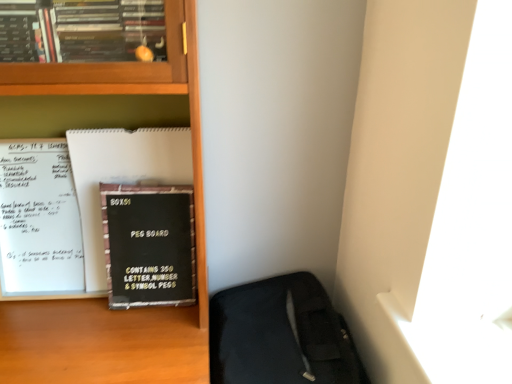
The height and width of the screenshot is (384, 512). I want to click on black matte peg board at center-left, so click(x=149, y=245).

Describe the element at coordinates (121, 176) in the screenshot. I see `black matte peg board at left` at that location.

What is the approximate height of black matte peg board at left?

black matte peg board at left is 17.56 inches in height.

Describe the element at coordinates (280, 335) in the screenshot. I see `black fabric sleeping bag at lower right` at that location.

Find the location of `black matte peg board at center-left`. black matte peg board at center-left is located at coordinates (149, 245).

Can we say black fabric sleeping bag at lower right lies outside wooden bookcase at center?

Absolutely, black fabric sleeping bag at lower right is external to wooden bookcase at center.

Is black fabric sleeping bag at lower right positioned far away from wooden bookcase at center?

black fabric sleeping bag at lower right is actually quite close to wooden bookcase at center.

Based on the photo, measure the distance from black fabric sleeping bag at lower right to wooden bookcase at center.

black fabric sleeping bag at lower right and wooden bookcase at center are 11.41 inches apart from each other.

From the picture: From the image's perspective, would you say black fabric sleeping bag at lower right is shown under wooden bookcase at center?

Yes, from the image's perspective, black fabric sleeping bag at lower right is below wooden bookcase at center.

Is black fabric sleeping bag at lower right surrounded by black matte peg board at left?

No, black matte peg board at left does not contain black fabric sleeping bag at lower right.

Locate an element on the screen. sleeping bag in front of the black matte peg board at left is located at coordinates (280, 335).

Does black matte peg board at left have a greater width compared to black fabric sleeping bag at lower right?

No, black matte peg board at left is not wider than black fabric sleeping bag at lower right.

Is black matte peg board at left turned away from black fabric sleeping bag at lower right?

That's not correct — black matte peg board at left is not looking away from black fabric sleeping bag at lower right.

From the image's perspective, is black matte peg board at left above or below black matte peg board at center-left?

Clearly, from the image's perspective, black matte peg board at left is above black matte peg board at center-left.

Can you see black matte peg board at left touching black matte peg board at center-left?

Yes, the surface of black matte peg board at left is in contact with black matte peg board at center-left.

Would you say black matte peg board at left is outside black matte peg board at center-left?

black matte peg board at left is positioned outside black matte peg board at center-left.

From a real-world perspective, is black matte peg board at left located beneath black matte peg board at center-left?

No.

Based on their positions, is wooden bookcase at center located to the left or right of black fabric sleeping bag at lower right?

wooden bookcase at center is to the left of black fabric sleeping bag at lower right.

Would you say wooden bookcase at center is a long distance from black fabric sleeping bag at lower right?

No, there isn't a large distance between wooden bookcase at center and black fabric sleeping bag at lower right.

Identify the location of sleeping bag below the wooden bookcase at center (from a real-world perspective). The image size is (512, 384). (280, 335).

Find the location of `book above the black fabric sleeping bag at lower right (from a real-world perspective)`. book above the black fabric sleeping bag at lower right (from a real-world perspective) is located at coordinates (149, 245).

From a real-world perspective, relative to black fabric sleeping bag at lower right, is black matte peg board at center-left vertically above or below?

Clearly, from a real-world perspective, black matte peg board at center-left is above black fabric sleeping bag at lower right.

Considering the sizes of black matte peg board at center-left and black fabric sleeping bag at lower right in the image, is black matte peg board at center-left bigger or smaller than black fabric sleeping bag at lower right?

black matte peg board at center-left is smaller than black fabric sleeping bag at lower right.

Visually, is black matte peg board at center-left positioned to the left or to the right of wooden bookcase at center?

Based on their positions, black matte peg board at center-left is located to the right of wooden bookcase at center.

Considering the sizes of objects black matte peg board at center-left and wooden bookcase at center in the image provided, who is shorter, black matte peg board at center-left or wooden bookcase at center?

With less height is black matte peg board at center-left.

Consider the image. Who is bigger, black matte peg board at center-left or wooden bookcase at center?

Bigger between the two is wooden bookcase at center.

Considering the positions of objects black matte peg board at center-left and black matte peg board at left in the image provided, who is more to the right, black matte peg board at center-left or black matte peg board at left?

black matte peg board at center-left is more to the right.

Is black matte peg board at center-left looking in the opposite direction of black matte peg board at left?

Correct, black matte peg board at center-left is looking away from black matte peg board at left.

At what (x,y) coordinates should I click in order to perform the action: click on book behind the black matte peg board at left. Please return your answer as a coordinate pair (x, y). This screenshot has width=512, height=384. Looking at the image, I should click on (149, 245).

Is the depth of black matte peg board at center-left greater than that of black matte peg board at left?

That is True.

Locate an element on the screen. The width and height of the screenshot is (512, 384). bookcase above the black fabric sleeping bag at lower right (from the image's perspective) is located at coordinates (103, 300).

In order to click on sleeping bag on the right of the black matte peg board at left in this screenshot , I will do `click(280, 335)`.

When comparing their distances from black fabric sleeping bag at lower right, does wooden bookcase at center or black matte peg board at left seem further?

black matte peg board at left is positioned further to the anchor black fabric sleeping bag at lower right.

Looking at the image, which one is located closer to black matte peg board at left, black fabric sleeping bag at lower right or wooden bookcase at center?

wooden bookcase at center lies closer to black matte peg board at left than the other object.

When comparing their distances from wooden bookcase at center, does black matte peg board at left or black fabric sleeping bag at lower right seem further?

black fabric sleeping bag at lower right is positioned further to the anchor wooden bookcase at center.

Which object lies nearer to the anchor point black matte peg board at center-left, black matte peg board at left or wooden bookcase at center?

black matte peg board at left is closer to black matte peg board at center-left.

Based on their spatial positions, is black matte peg board at left or black matte peg board at center-left closer to black fabric sleeping bag at lower right?

black matte peg board at center-left.

Looking at the image, which one is located further to black matte peg board at left, wooden bookcase at center or black matte peg board at center-left?

wooden bookcase at center is positioned further to the anchor black matte peg board at left.

Consider the image. Looking at the image, which one is located closer to wooden bookcase at center, black fabric sleeping bag at lower right or black matte peg board at left?

black matte peg board at left.

Looking at the image, which one is located closer to black matte peg board at left, wooden bookcase at center or black fabric sleeping bag at lower right?

wooden bookcase at center lies closer to black matte peg board at left than the other object.

At what (x,y) coordinates should I click in order to perform the action: click on paperback book located between wooden bookcase at center and black matte peg board at center-left in the depth direction. Please return your answer as a coordinate pair (x, y). This screenshot has width=512, height=384. Looking at the image, I should click on (121, 176).

This screenshot has height=384, width=512. I want to click on paperback book between wooden bookcase at center and black fabric sleeping bag at lower right in the horizontal direction, so click(121, 176).

Locate an element on the screen. The image size is (512, 384). sleeping bag between wooden bookcase at center and black matte peg board at center-left in the front-back direction is located at coordinates (280, 335).

Image resolution: width=512 pixels, height=384 pixels. Find the location of `book between black matte peg board at left and black fabric sleeping bag at lower right in the up-down direction`. book between black matte peg board at left and black fabric sleeping bag at lower right in the up-down direction is located at coordinates (149, 245).